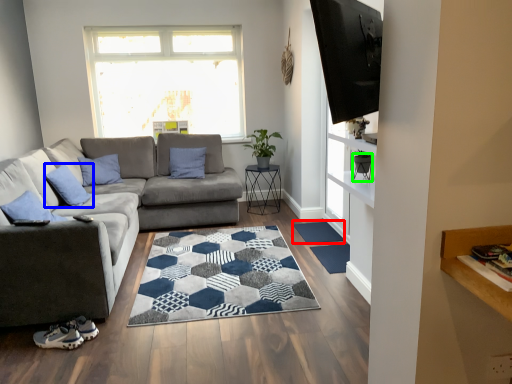
Question: Estimate the real-world distances between objects in this image. Which object is closer to doormat (highlighted by a red box), pillow (highlighted by a blue box) or chair (highlighted by a green box)?

Choices:
 (A) pillow
 (B) chair

Answer: (B)